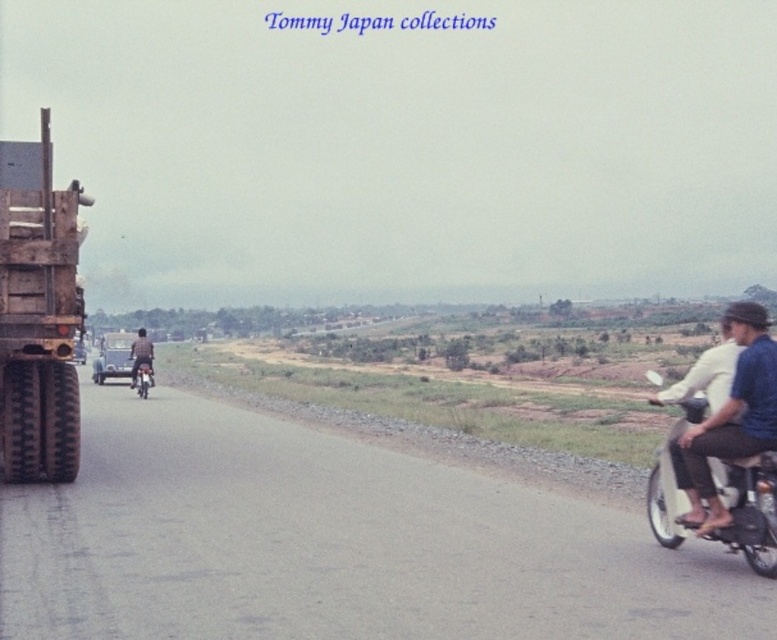
Is point (136, 376) in front of point (140, 362)?

No.

Can you confirm if dark blue shirt at center-left is positioned below metallic silver motorcycle at center-left?

No, dark blue shirt at center-left is not below metallic silver motorcycle at center-left.

I want to click on dark blue shirt at center-left, so click(141, 355).

This screenshot has height=640, width=777. I want to click on dark blue shirt at center-left, so click(141, 355).

Is rusty metal truck at left below metallic silver scooter at right?

No, rusty metal truck at left is not below metallic silver scooter at right.

Is rusty metal truck at left closer to the viewer compared to metallic silver scooter at right?

That is False.

Where is `rusty metal truck at left`? The height and width of the screenshot is (640, 777). rusty metal truck at left is located at coordinates (37, 314).

Is metallic silver scooter at right further to camera compared to metallic silver motorcycle at center-left?

No, it is in front of metallic silver motorcycle at center-left.

Does metallic silver scooter at right come in front of metallic silver motorcycle at center-left?

Yes, it is.

From the picture: Who is more forward, (769,486) or (148,380)?

Positioned in front is point (769,486).

Image resolution: width=777 pixels, height=640 pixels. Find the location of `metallic silver scooter at right`. metallic silver scooter at right is located at coordinates (748, 508).